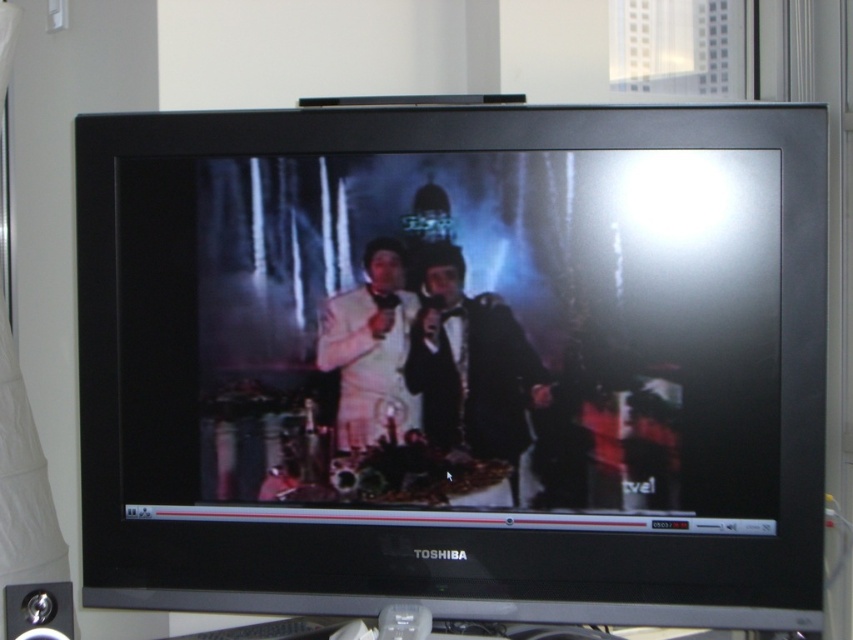
Question: Estimate the real-world distances between objects in this image. Which object is closer to the black satin tuxedo at center?

Choices:
 (A) black glossy monitor at center
 (B) white satin suit at center

Answer: (B)

Question: Based on their relative distances, which object is nearer to the black satin tuxedo at center?

Choices:
 (A) black glossy monitor at center
 (B) white satin suit at center

Answer: (B)

Question: Does black satin tuxedo at center have a smaller size compared to white satin suit at center?

Choices:
 (A) no
 (B) yes

Answer: (A)

Question: Is black satin tuxedo at center closer to camera compared to white satin suit at center?

Choices:
 (A) no
 (B) yes

Answer: (B)

Question: Is black glossy monitor at center wider than black satin tuxedo at center?

Choices:
 (A) no
 (B) yes

Answer: (B)

Question: Based on their relative distances, which object is farther from the black glossy monitor at center?

Choices:
 (A) white satin suit at center
 (B) black satin tuxedo at center

Answer: (A)